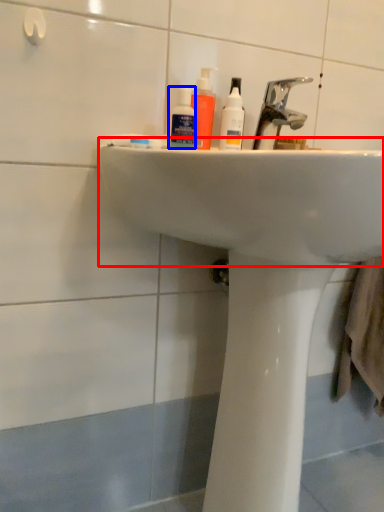
Question: Which object is closer to the camera taking this photo, sink (highlighted by a red box) or mouthwash (highlighted by a blue box)?

Choices:
 (A) sink
 (B) mouthwash

Answer: (A)